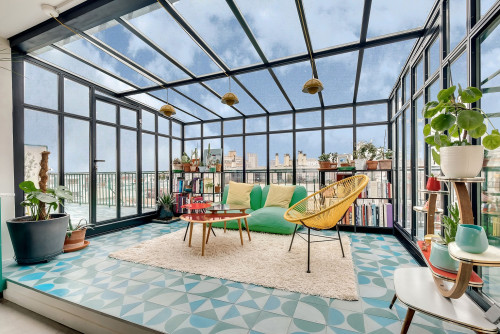
This screenshot has width=500, height=334. What are the coordinates of `bookcase` in the screenshot? It's located at (380, 215), (380, 184).